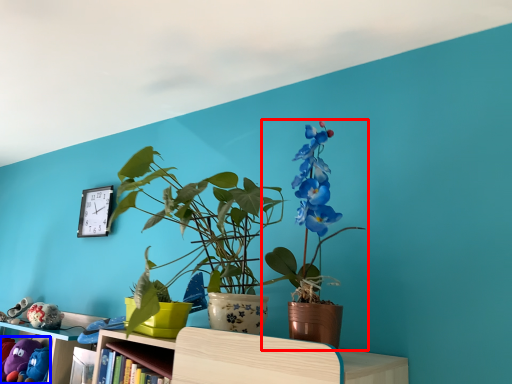
Question: Among these objects, which one is farthest to the camera, houseplant (highlighted by a red box) or toy (highlighted by a blue box)?

Choices:
 (A) houseplant
 (B) toy

Answer: (B)